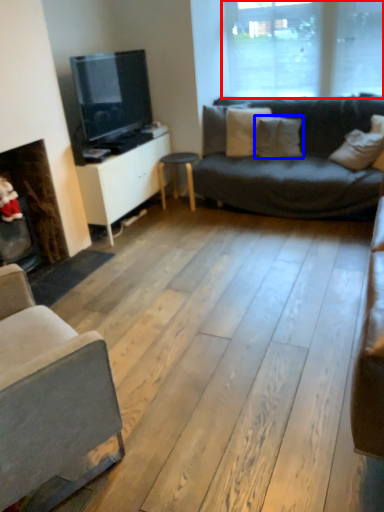
Question: Which of the following is the farthest to the observer, window (highlighted by a red box) or pillow (highlighted by a blue box)?

Choices:
 (A) window
 (B) pillow

Answer: (B)